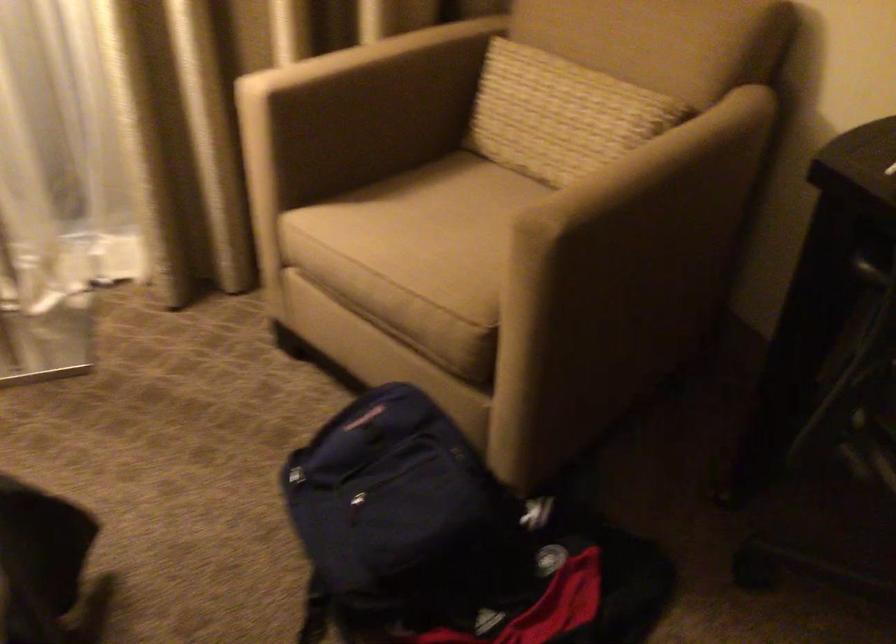
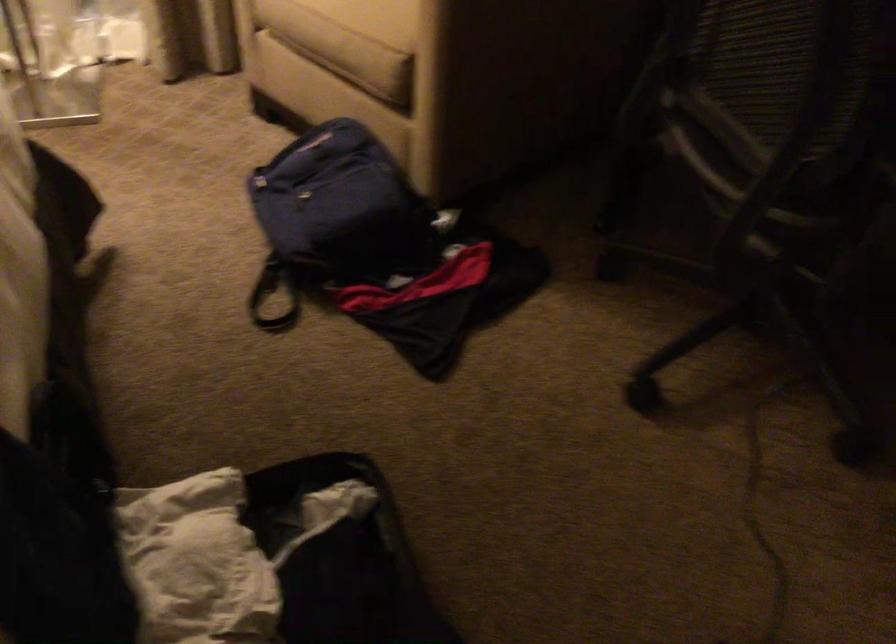
From the picture: What movement of the cameraman would produce the second image?

The cameraman moved toward right, backward.